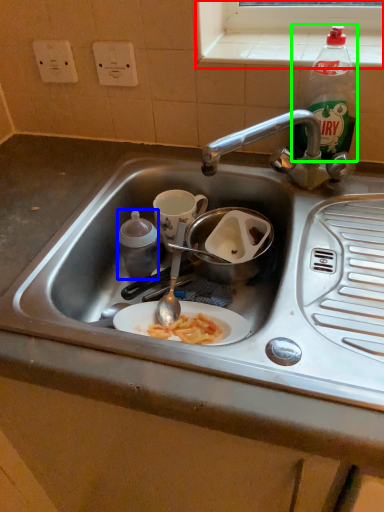
Question: Which object is positioned farthest from window sill (highlighted by a red box)? Select from bottle (highlighted by a blue box) and bottle (highlighted by a green box).

Choices:
 (A) bottle
 (B) bottle

Answer: (A)